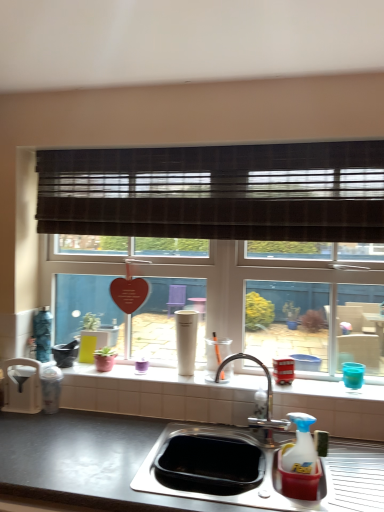
Question: From the image's perspective, would you say white matte cup at center, the third appliance viewed from the right, is positioned over white glossy window sill at center?

Choices:
 (A) yes
 (B) no

Answer: (A)

Question: Considering the relative positions of white matte cup at center, the third appliance viewed from the right, and white glossy window sill at center in the image provided, is white matte cup at center, the third appliance viewed from the right, to the right of white glossy window sill at center from the viewer's perspective?

Choices:
 (A) yes
 (B) no

Answer: (B)

Question: Is the depth of white matte cup at center, the third appliance from the left, greater than that of white glossy window sill at center?

Choices:
 (A) no
 (B) yes

Answer: (B)

Question: Does white matte cup at center, the third appliance viewed from the right, come in front of white glossy window sill at center?

Choices:
 (A) no
 (B) yes

Answer: (A)

Question: Is white matte cup at center, the third appliance viewed from the right, smaller than white glossy window sill at center?

Choices:
 (A) yes
 (B) no

Answer: (A)

Question: Does white matte cup at center, the third appliance viewed from the right, appear on the left side of white glossy window sill at center?

Choices:
 (A) no
 (B) yes

Answer: (B)

Question: From the image's perspective, does metallic red bus at right, the 2th appliance in the right-to-left sequence, appear higher than chrome metallic faucet at center?

Choices:
 (A) yes
 (B) no

Answer: (A)

Question: Is metallic red bus at right, the 2th appliance in the right-to-left sequence, closer to the viewer compared to chrome metallic faucet at center?

Choices:
 (A) no
 (B) yes

Answer: (A)

Question: Is there a large distance between metallic red bus at right, positioned as the fourth appliance in left-to-right order, and chrome metallic faucet at center?

Choices:
 (A) yes
 (B) no

Answer: (B)

Question: Considering the relative sizes of metallic red bus at right, positioned as the fourth appliance in left-to-right order, and chrome metallic faucet at center in the image provided, is metallic red bus at right, positioned as the fourth appliance in left-to-right order, thinner than chrome metallic faucet at center?

Choices:
 (A) yes
 (B) no

Answer: (A)

Question: Does metallic red bus at right, positioned as the fourth appliance in left-to-right order, turn towards chrome metallic faucet at center?

Choices:
 (A) yes
 (B) no

Answer: (B)

Question: Is metallic red bus at right, the 2th appliance in the right-to-left sequence, to the right of chrome metallic faucet at center from the viewer's perspective?

Choices:
 (A) yes
 (B) no

Answer: (A)

Question: Would you say brown textured blind at upper center contains white matte cup at center, the third appliance viewed from the right?

Choices:
 (A) yes
 (B) no

Answer: (B)